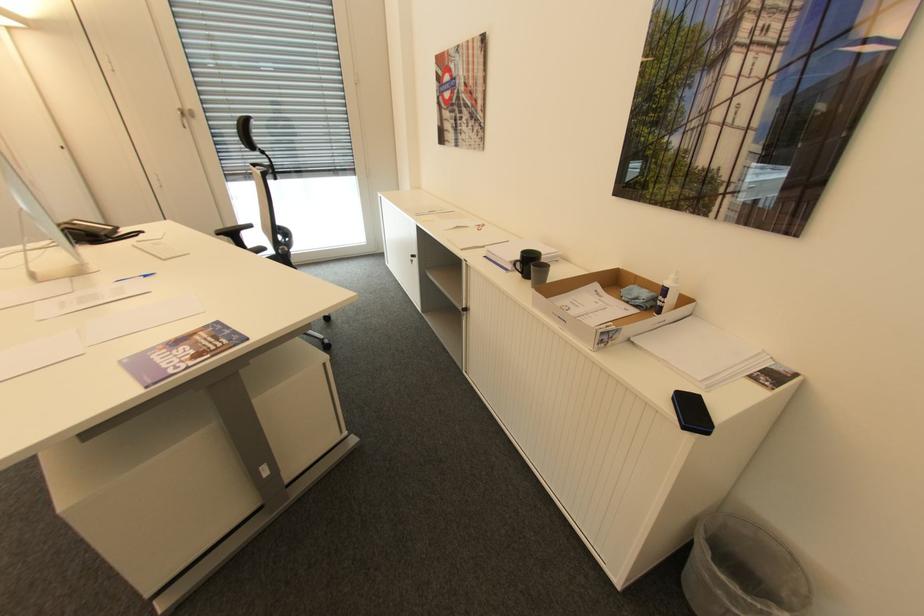
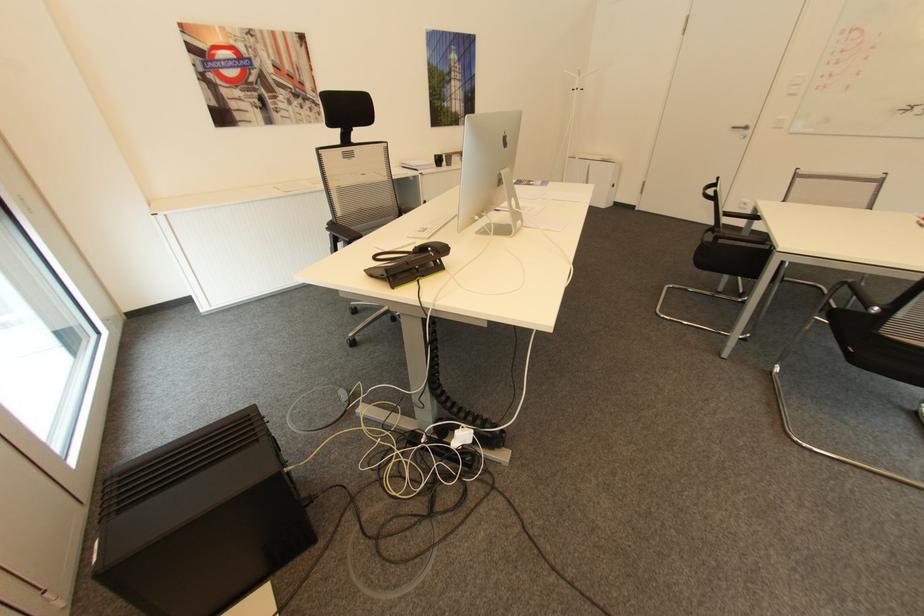
Find the pixel in the second image that matches pixel 487 124 in the first image.

(322, 102)